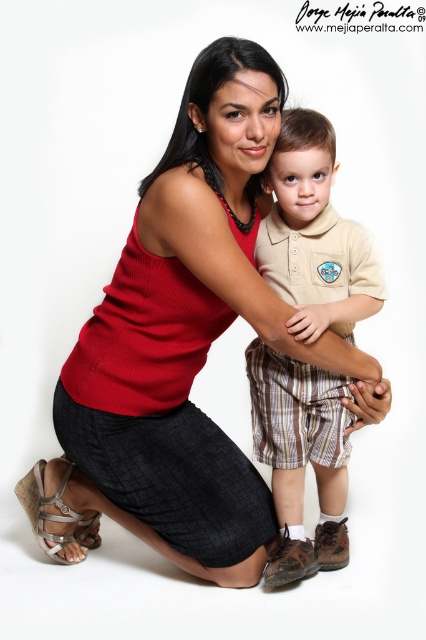
You are standing in front of the image and want to determine which of the two points, point [310,330] or point [65,504], is nearer to you. Based on the scene description, which point is closer?

Point [310,330] is closer to the camera than point [65,504], so it is the nearer one.

You are designing a layout for a clothing catalog and need to place the matte red tank top at center and the silver metallic sandal at lower left. Given their sizes, which item should be placed higher on the page to maintain visual balance?

The matte red tank top at center should be placed higher on the page since it has a greater height compared to the silver metallic sandal at lower left, helping to balance the composition.

You are a photographer setting up a photoshoot. You need to position two models so that the matte red tank top at center and the beige cotton polo shirt at center are visible in the frame. According to the scene description, which clothing item is positioned to the left side of the other?

The matte red tank top at center is positioned to the left of the beige cotton polo shirt at center.